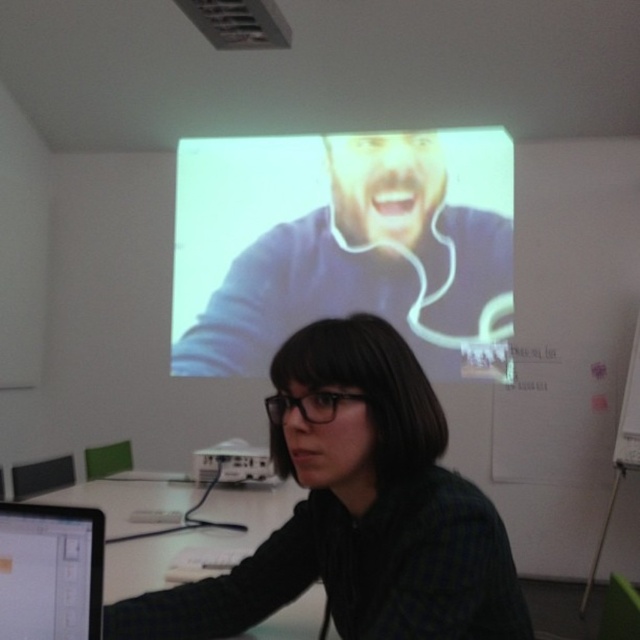
Question: Considering the real-world distances, which object is farthest from the white plastic projector at center?

Choices:
 (A) black matte shirt at center
 (B) white glossy screen at upper center
 (C) matte black monitor at lower left
 (D) white glossy table at center

Answer: (B)

Question: Which is farther from the white glossy screen at upper center?

Choices:
 (A) matte black monitor at lower left
 (B) black matte shirt at center

Answer: (A)

Question: Is white glossy screen at upper center positioned before white glossy table at center?

Choices:
 (A) yes
 (B) no

Answer: (B)

Question: Is white glossy screen at upper center smaller than white plastic projector at center?

Choices:
 (A) yes
 (B) no

Answer: (B)

Question: Which point appears closest to the camera in this image?

Choices:
 (A) tap(268, 465)
 (B) tap(444, 221)
 (C) tap(228, 625)
 (D) tap(125, 561)

Answer: (C)

Question: Does white glossy table at center appear on the right side of white plastic projector at center?

Choices:
 (A) yes
 (B) no

Answer: (B)